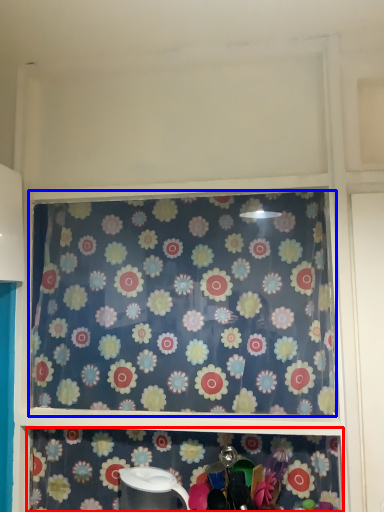
Question: Which object appears farthest to the camera in this image, shelf (highlighted by a red box) or curtain (highlighted by a blue box)?

Choices:
 (A) shelf
 (B) curtain

Answer: (B)